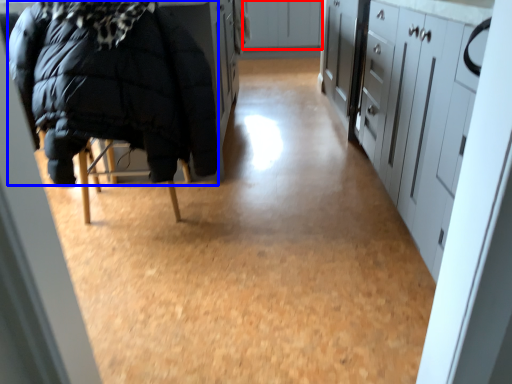
Question: Among these objects, which one is nearest to the camera, cabinetry (highlighted by a red box) or jacket (highlighted by a blue box)?

Choices:
 (A) cabinetry
 (B) jacket

Answer: (B)